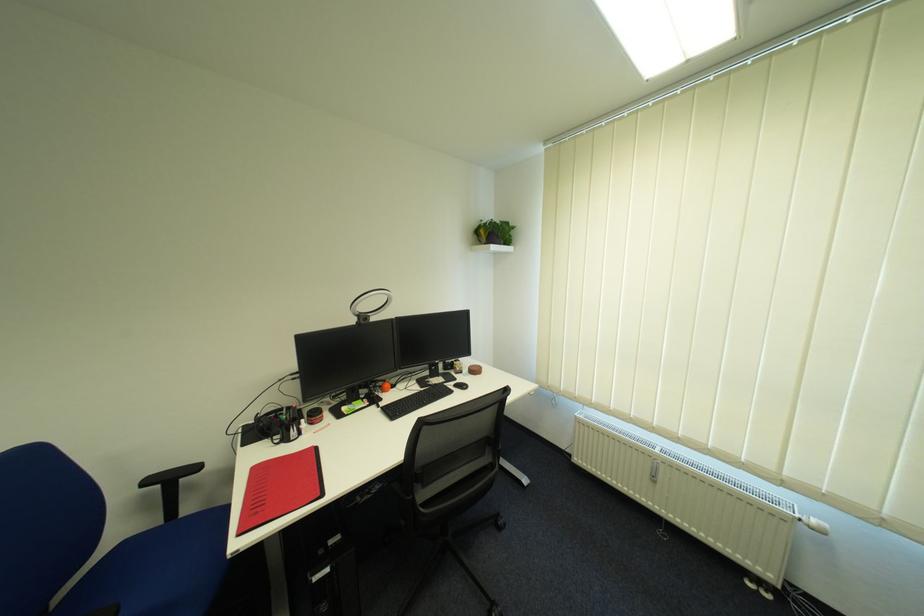
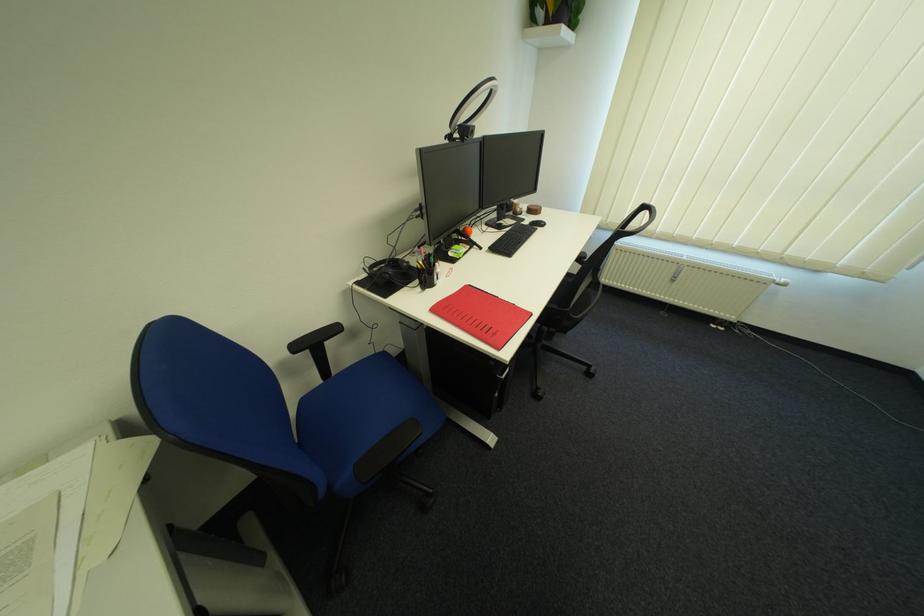
Find the pixel in the second image that matches point 157,483 in the first image.

(306, 349)